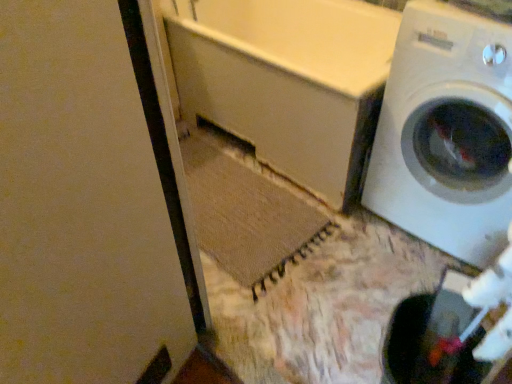
Question: Considering the relative sizes of white glossy washing machine at right and white matte screen door at upper left in the image provided, is white glossy washing machine at right thinner than white matte screen door at upper left?

Choices:
 (A) no
 (B) yes

Answer: (A)

Question: Is white glossy washing machine at right not near white matte screen door at upper left?

Choices:
 (A) yes
 (B) no

Answer: (A)

Question: Is white glossy washing machine at right turned away from white matte screen door at upper left?

Choices:
 (A) no
 (B) yes

Answer: (A)

Question: Is white glossy washing machine at right surrounding white matte screen door at upper left?

Choices:
 (A) no
 (B) yes

Answer: (A)

Question: Does white glossy washing machine at right touch white matte screen door at upper left?

Choices:
 (A) yes
 (B) no

Answer: (B)

Question: From the image's perspective, is white glossy washing machine at right located above white matte screen door at upper left?

Choices:
 (A) yes
 (B) no

Answer: (A)

Question: Can you confirm if white matte bathtub at center is shorter than white matte screen door at upper left?

Choices:
 (A) yes
 (B) no

Answer: (A)

Question: From the image's perspective, does white matte bathtub at center appear lower than white matte screen door at upper left?

Choices:
 (A) yes
 (B) no

Answer: (B)

Question: Is white matte bathtub at center to the right of white matte screen door at upper left from the viewer's perspective?

Choices:
 (A) yes
 (B) no

Answer: (A)

Question: Considering the relative positions of white matte bathtub at center and white matte screen door at upper left in the image provided, is white matte bathtub at center behind white matte screen door at upper left?

Choices:
 (A) no
 (B) yes

Answer: (B)

Question: From the image's perspective, is white matte bathtub at center on top of white matte screen door at upper left?

Choices:
 (A) yes
 (B) no

Answer: (A)

Question: Is white matte bathtub at center aimed at white matte screen door at upper left?

Choices:
 (A) no
 (B) yes

Answer: (B)

Question: Is the depth of white matte screen door at upper left less than that of white matte bathtub at center?

Choices:
 (A) no
 (B) yes

Answer: (B)